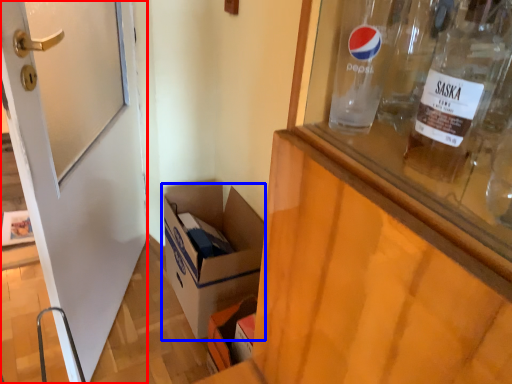
Question: Which object appears closest to the camera in this image, door (highlighted by a red box) or box (highlighted by a blue box)?

Choices:
 (A) door
 (B) box

Answer: (A)